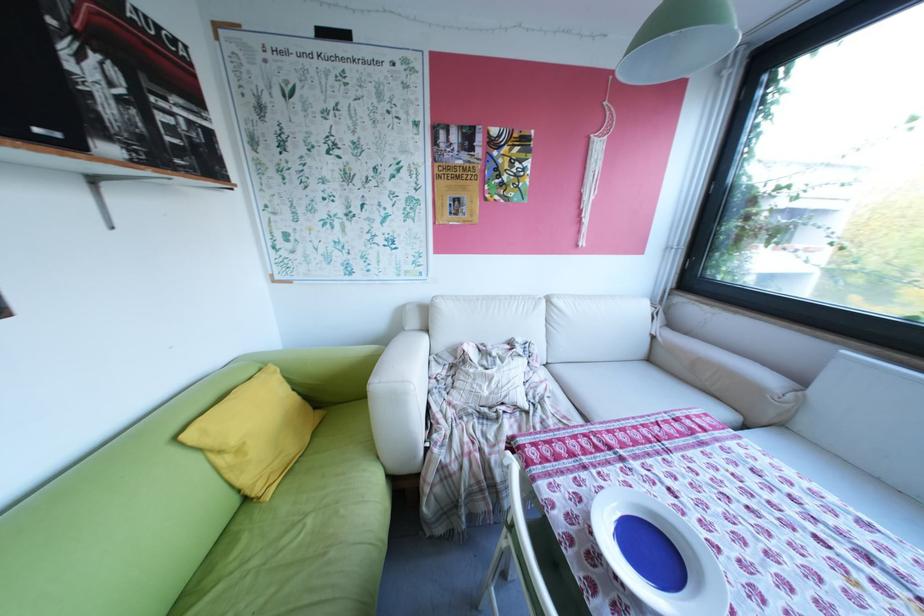
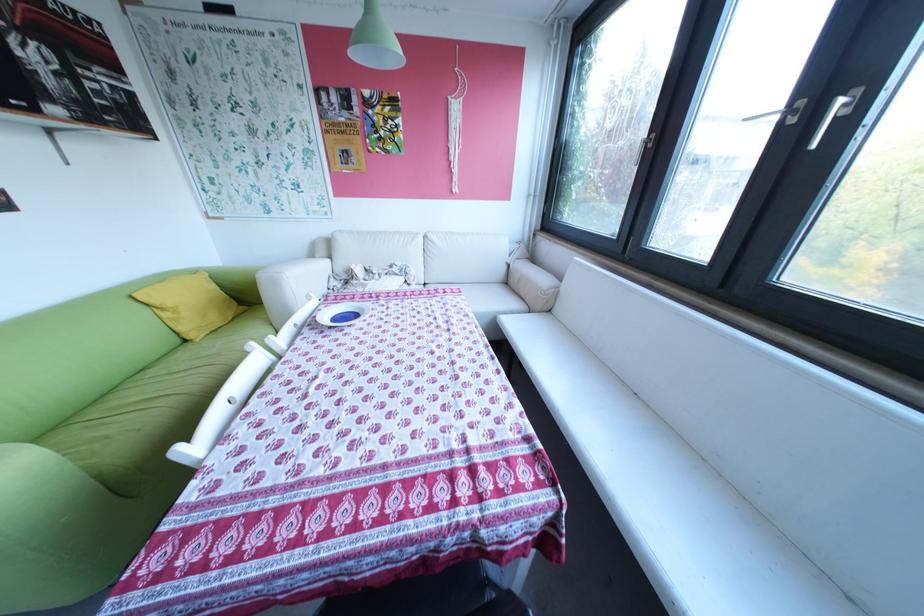
Find the pixel in the second image that matches pixel 410 398 in the first image.

(288, 283)